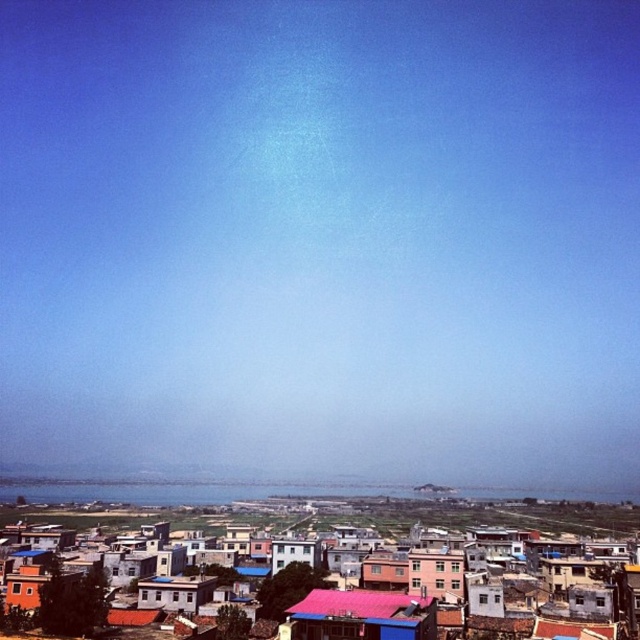
Is pink matte building at center above white painted wood hut at center?

Incorrect, pink matte building at center is not positioned above white painted wood hut at center.

Is pink matte building at center thinner than white painted wood hut at center?

Yes.

The image size is (640, 640). In order to click on pink matte building at center in this screenshot , I will do `click(436, 573)`.

Between red corrugated metal roof at center and white painted wood hut at center, which one has more height?

Standing taller between the two is red corrugated metal roof at center.

Can you confirm if red corrugated metal roof at center is thinner than white painted wood hut at center?

No, red corrugated metal roof at center is not thinner than white painted wood hut at center.

You are a GUI agent. You are given a task and a screenshot of the screen. Output one action in this format:
    pyautogui.click(x=<x>, y=<y>)
    Task: Click on the red corrugated metal roof at center
    The height and width of the screenshot is (640, 640).
    Given the screenshot: What is the action you would take?
    pyautogui.click(x=362, y=616)

The width and height of the screenshot is (640, 640). What do you see at coordinates (364, 516) in the screenshot?
I see `multicolored tiled roofs at center` at bounding box center [364, 516].

Is multicolored tiled roofs at center below pink matte building at center?

Yes.

Which is in front, point (202, 522) or point (422, 586)?

Point (422, 586) is more forward.

Where is `multicolored tiled roofs at center`? Image resolution: width=640 pixels, height=640 pixels. multicolored tiled roofs at center is located at coordinates (364, 516).